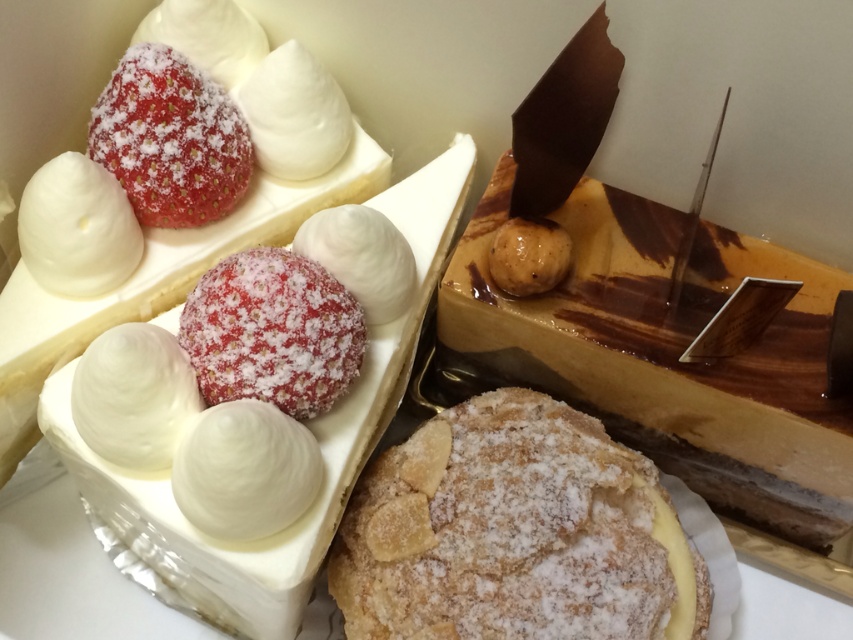
Which of the desserts is located at the coordinates point (271, 332)?

The sugar coated strawberry at center is located at point (271, 332).

What is the object located at the coordinates point (514, 532)?

The object at point (514, 532) is the powdered sugar pastry at center.